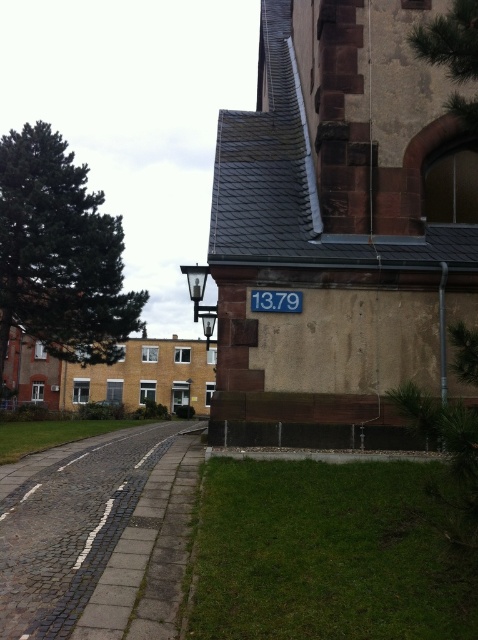
Which is more to the right, cobblestone road at lower left or blue painted metal sign at center?

From the viewer's perspective, blue painted metal sign at center appears more on the right side.

Does cobblestone road at lower left have a greater width compared to blue painted metal sign at center?

Indeed, cobblestone road at lower left has a greater width compared to blue painted metal sign at center.

What do you see at coordinates (72, 529) in the screenshot? This screenshot has height=640, width=478. I see `cobblestone road at lower left` at bounding box center [72, 529].

Locate an element on the screen. Image resolution: width=478 pixels, height=640 pixels. cobblestone road at lower left is located at coordinates (72, 529).